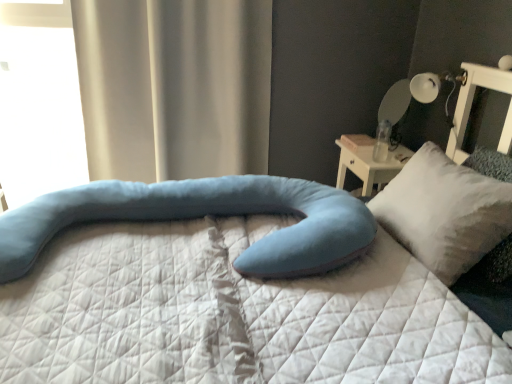
Question: From the image's perspective, is soft blue fabric pillow at center, marked as the 1th pillow in a left-to-right arrangement, under white glossy table lamp at upper right?

Choices:
 (A) no
 (B) yes

Answer: (B)

Question: Is soft blue fabric pillow at center, marked as the 1th pillow in a left-to-right arrangement, aimed at white glossy table lamp at upper right?

Choices:
 (A) no
 (B) yes

Answer: (A)

Question: Does soft blue fabric pillow at center, placed as the 2th pillow when sorted from right to left, have a greater width compared to white glossy table lamp at upper right?

Choices:
 (A) no
 (B) yes

Answer: (B)

Question: Can you confirm if soft blue fabric pillow at center, marked as the 1th pillow in a left-to-right arrangement, is positioned to the left of white glossy table lamp at upper right?

Choices:
 (A) no
 (B) yes

Answer: (B)

Question: Is white glossy table lamp at upper right at the back of soft blue fabric pillow at center, placed as the 2th pillow when sorted from right to left?

Choices:
 (A) yes
 (B) no

Answer: (B)

Question: Does point (452, 84) appear closer or farther from the camera than point (168, 200)?

Choices:
 (A) farther
 (B) closer

Answer: (A)

Question: From a real-world perspective, is white glossy table lamp at upper right above or below soft blue fabric pillow at center, placed as the 2th pillow when sorted from right to left?

Choices:
 (A) above
 (B) below

Answer: (A)

Question: Considering the relative positions of white glossy table lamp at upper right and soft blue fabric pillow at center, marked as the 1th pillow in a left-to-right arrangement, in the image provided, is white glossy table lamp at upper right to the left or to the right of soft blue fabric pillow at center, marked as the 1th pillow in a left-to-right arrangement,?

Choices:
 (A) right
 (B) left

Answer: (A)

Question: In terms of size, does white glossy table lamp at upper right appear bigger or smaller than soft blue fabric pillow at center, marked as the 1th pillow in a left-to-right arrangement?

Choices:
 (A) small
 (B) big

Answer: (A)

Question: Is transparent glass window at upper left wider or thinner than white glossy table lamp at upper right?

Choices:
 (A) thin
 (B) wide

Answer: (A)

Question: Is point tap(10, 48) positioned closer to the camera than point tap(454, 87)?

Choices:
 (A) closer
 (B) farther

Answer: (B)

Question: From the image's perspective, is transparent glass window at upper left positioned above or below white glossy table lamp at upper right?

Choices:
 (A) below
 (B) above

Answer: (B)

Question: Based on their positions, is transparent glass window at upper left located to the left or right of white glossy table lamp at upper right?

Choices:
 (A) left
 (B) right

Answer: (A)

Question: Looking at the image, does transparent glass window at upper left seem bigger or smaller compared to satin beige curtain at upper left?

Choices:
 (A) small
 (B) big

Answer: (A)

Question: Considering the positions of transparent glass window at upper left and satin beige curtain at upper left in the image, is transparent glass window at upper left taller or shorter than satin beige curtain at upper left?

Choices:
 (A) short
 (B) tall

Answer: (A)